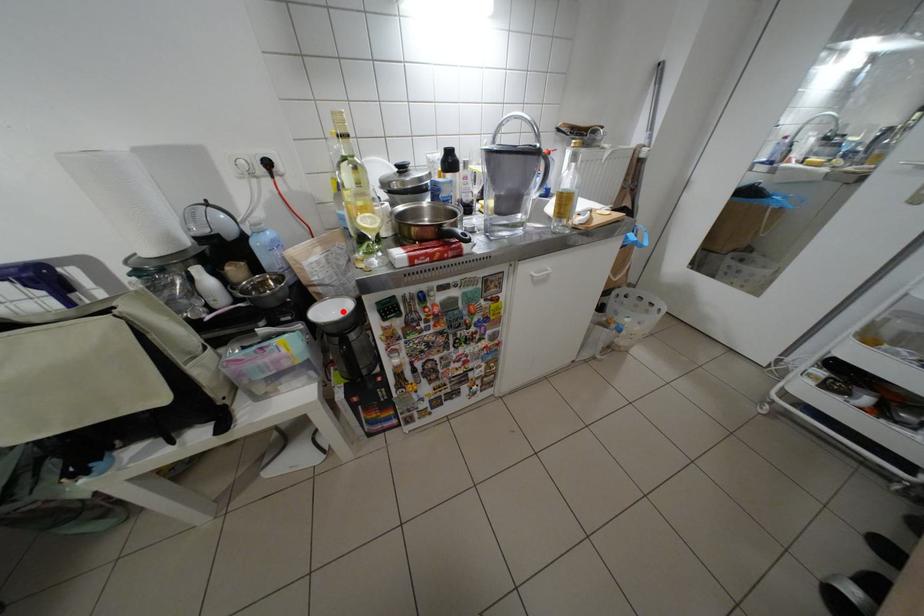
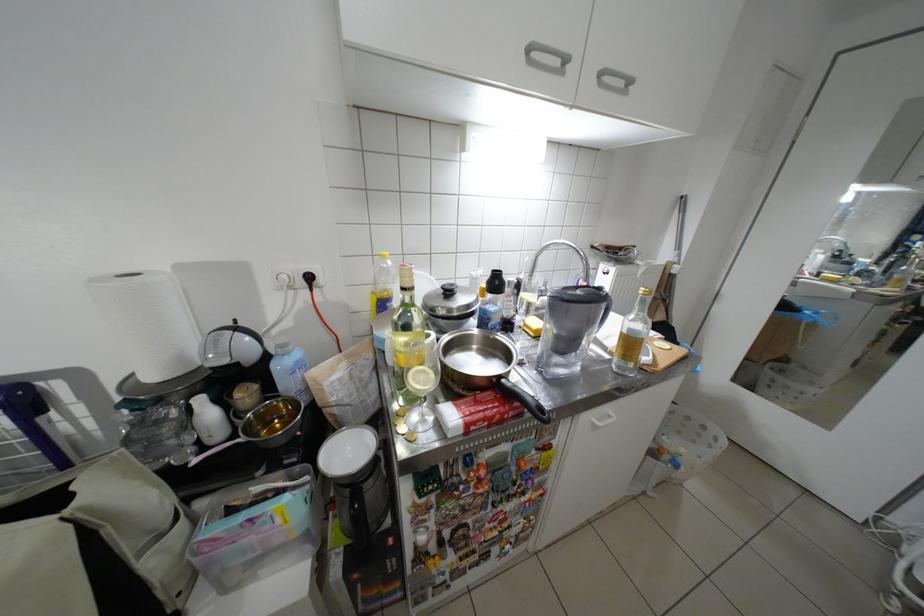
Question: A red point is marked in image1. In image2, is the corresponding 3D point closer to the camera or farther? Reply with the corresponding letter.

Choices:
 (A) The corresponding 3D point is closer.
 (B) The corresponding 3D point is farther.

Answer: (A)